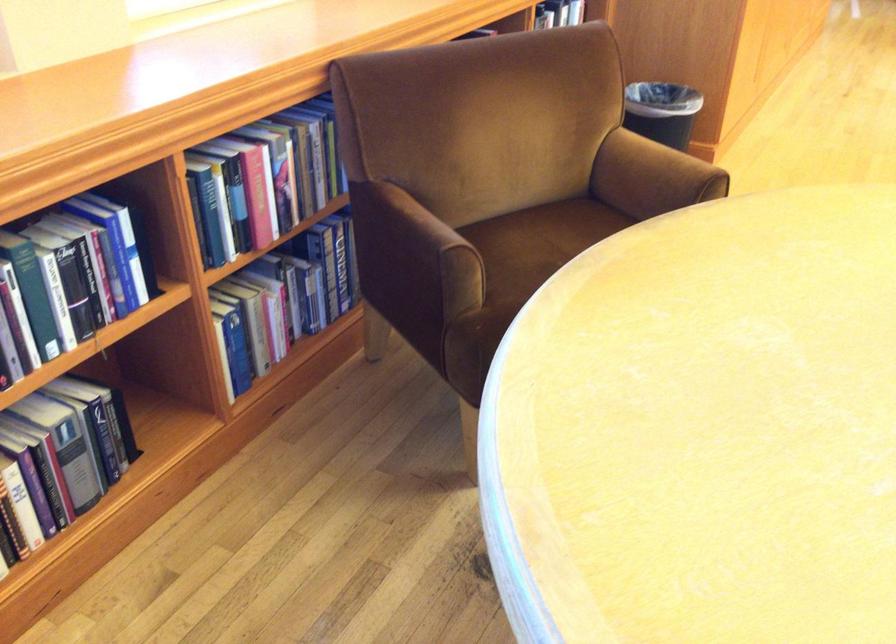
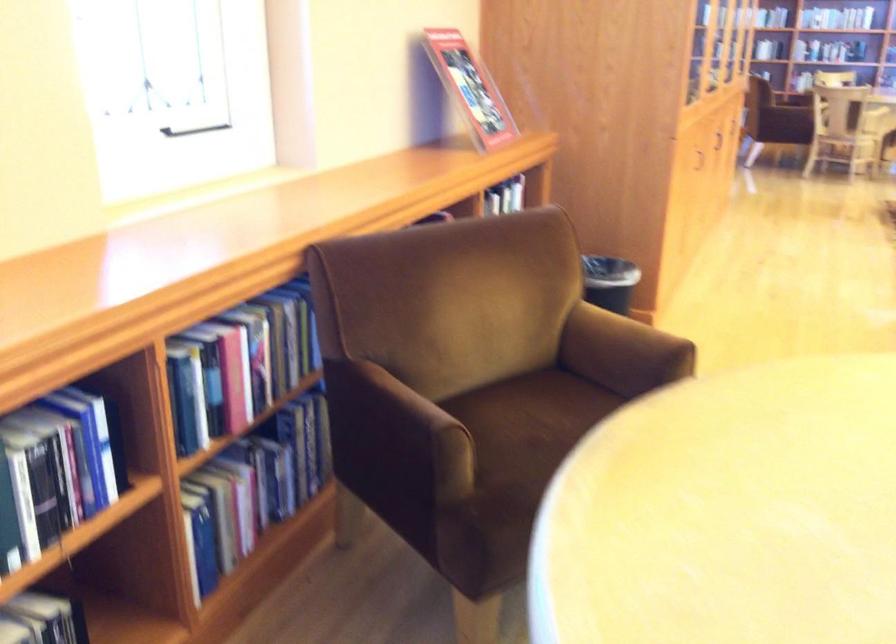
The point at (255, 319) is marked in the first image. Where is the corresponding point in the second image?

(227, 511)